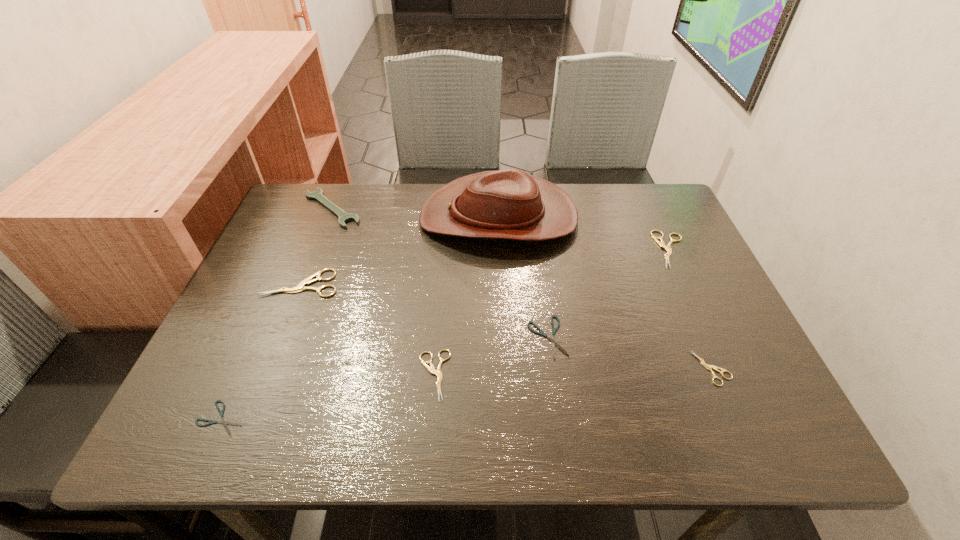
The image size is (960, 540). Find the location of `object that is positioned at the far right corner`. object that is positioned at the far right corner is located at coordinates (661, 243).

This screenshot has width=960, height=540. In order to click on vacant area at the far edge of the desktop in this screenshot , I will do `click(399, 231)`.

Identify the location of vacant region at the near edge of the desktop. This screenshot has height=540, width=960. (315, 443).

Image resolution: width=960 pixels, height=540 pixels. In order to click on free location at the right edge of the desktop in this screenshot , I will do `click(674, 349)`.

Where is `vacant space at the far left corner`? vacant space at the far left corner is located at coordinates (324, 226).

The image size is (960, 540). In the image, there is a desktop. What are the coordinates of `vacant space at the far right corner` in the screenshot? It's located at (660, 190).

Image resolution: width=960 pixels, height=540 pixels. I want to click on vacant position at the near right corner of the desktop, so click(x=738, y=445).

You are a GUI agent. You are given a task and a screenshot of the screen. Output one action in this format:
    pyautogui.click(x=<x>, y=<y>)
    Task: Click on the vacant point located between the smallest beige shears and the fourth farthest object
    The height and width of the screenshot is (540, 960).
    Given the screenshot: What is the action you would take?
    pyautogui.click(x=506, y=326)

Identify the location of vacant region between the tallest shears and the farthest beige shears. (487, 267).

This screenshot has width=960, height=540. In order to click on free spot between the farthest shears and the fourth shears from left to right in this screenshot , I will do `click(610, 294)`.